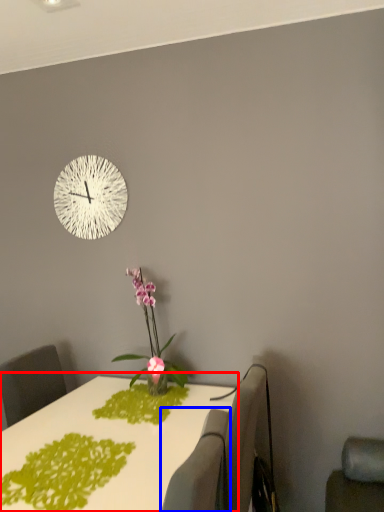
Question: Which of the following is the closest to the observer, table (highlighted by a red box) or swivel chair (highlighted by a blue box)?

Choices:
 (A) table
 (B) swivel chair

Answer: (B)